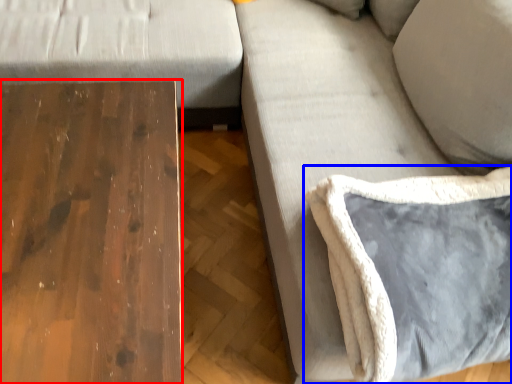
Question: Which point is further to the camera, table (highlighted by a red box) or pillow (highlighted by a blue box)?

Choices:
 (A) table
 (B) pillow

Answer: (B)